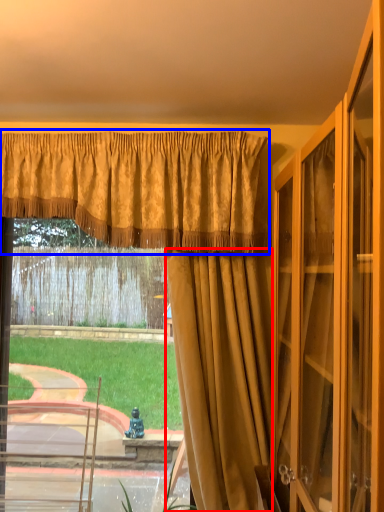
Question: Among these objects, which one is farthest to the camera, curtain (highlighted by a red box) or curtain (highlighted by a blue box)?

Choices:
 (A) curtain
 (B) curtain

Answer: (B)